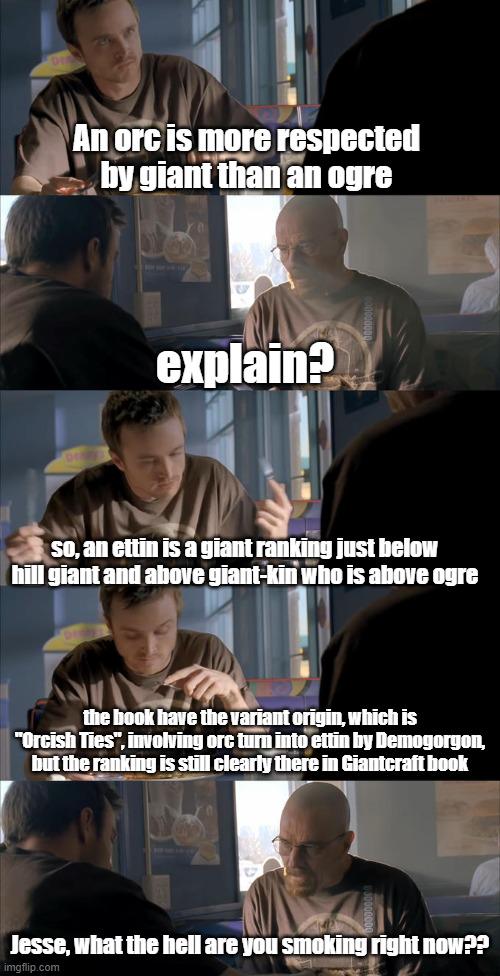
Identify the location of wall. The width and height of the screenshot is (500, 976). (164, 817), (412, 816), (24, 628), (28, 430), (424, 232), (174, 249), (26, 48).